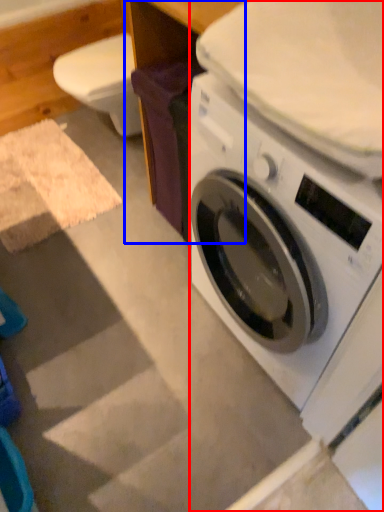
Question: Which of the following is the closest to the observer, washing machine (highlighted by a red box) or table (highlighted by a blue box)?

Choices:
 (A) washing machine
 (B) table

Answer: (A)